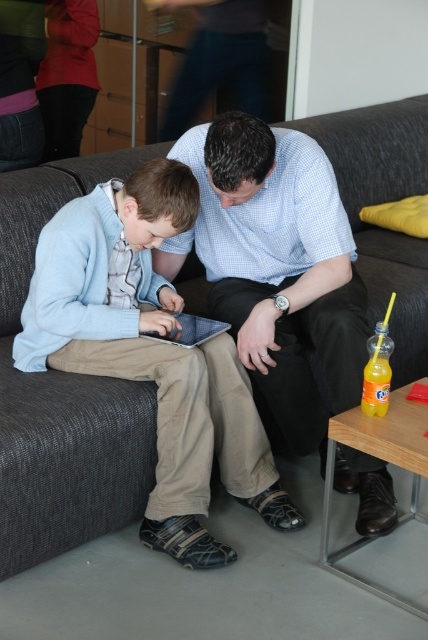
Question: Considering the relative positions of light blue sweater at center and blue checkered shirt at center in the image provided, where is light blue sweater at center located with respect to blue checkered shirt at center?

Choices:
 (A) right
 (B) left

Answer: (B)

Question: Among these points, which one is nearest to the camera?

Choices:
 (A) (339, 241)
 (B) (178, 216)

Answer: (B)

Question: Which point is farther to the camera?

Choices:
 (A) light blue sweater at center
 (B) blue checkered shirt at center

Answer: (A)

Question: From the image, what is the correct spatial relationship of light blue sweater at center in relation to blue checkered shirt at center?

Choices:
 (A) right
 (B) left

Answer: (B)

Question: Can you confirm if light blue sweater at center is bigger than blue checkered shirt at center?

Choices:
 (A) yes
 (B) no

Answer: (B)